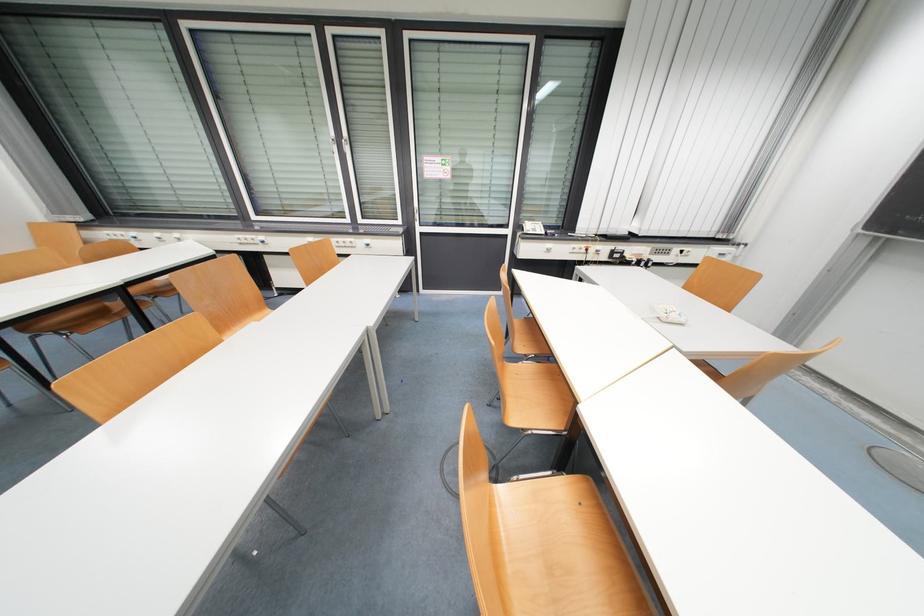
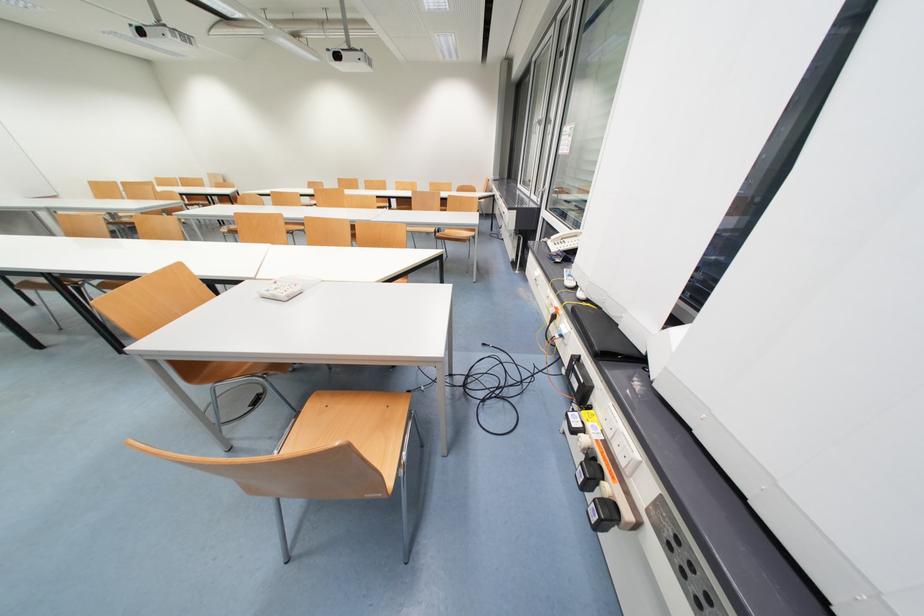
In the second image, find the point that corresponds to pixel 592 252 in the first image.

(560, 318)